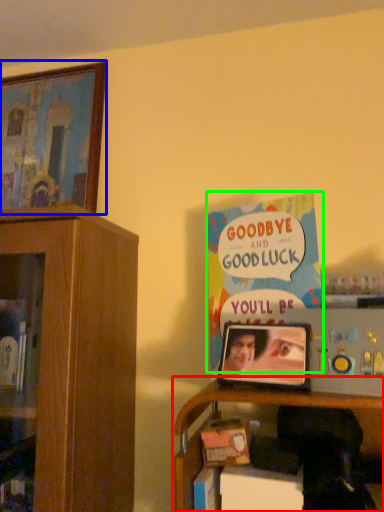
Question: Which is farther away from shelf (highlighted by a red box)? picture frame (highlighted by a blue box) or book (highlighted by a green box)?

Choices:
 (A) picture frame
 (B) book

Answer: (A)